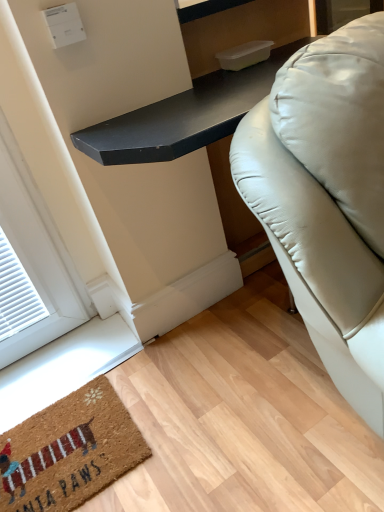
Question: From the image's perspective, is black matte table at center over brown coir mat at lower left?

Choices:
 (A) yes
 (B) no

Answer: (A)

Question: Considering the relative positions of black matte table at center and brown coir mat at lower left in the image provided, is black matte table at center behind brown coir mat at lower left?

Choices:
 (A) yes
 (B) no

Answer: (B)

Question: Is black matte table at center positioned in front of brown coir mat at lower left?

Choices:
 (A) yes
 (B) no

Answer: (A)

Question: Would you say black matte table at center contains brown coir mat at lower left?

Choices:
 (A) yes
 (B) no

Answer: (B)

Question: Is black matte table at center at the right side of brown coir mat at lower left?

Choices:
 (A) no
 (B) yes

Answer: (B)

Question: From a real-world perspective, is black matte table at center physically above brown coir mat at lower left?

Choices:
 (A) yes
 (B) no

Answer: (A)

Question: Can you confirm if brown coir mat at lower left is taller than black matte table at center?

Choices:
 (A) yes
 (B) no

Answer: (B)

Question: Is brown coir mat at lower left oriented towards black matte table at center?

Choices:
 (A) no
 (B) yes

Answer: (A)

Question: Does brown coir mat at lower left have a smaller size compared to black matte table at center?

Choices:
 (A) no
 (B) yes

Answer: (B)

Question: From a real-world perspective, is brown coir mat at lower left beneath black matte table at center?

Choices:
 (A) yes
 (B) no

Answer: (A)

Question: Is brown coir mat at lower left bigger than black matte table at center?

Choices:
 (A) yes
 (B) no

Answer: (B)

Question: Considering the relative sizes of brown coir mat at lower left and black matte table at center in the image provided, is brown coir mat at lower left thinner than black matte table at center?

Choices:
 (A) yes
 (B) no

Answer: (A)

Question: Is black matte table at center inside or outside of brown coir mat at lower left?

Choices:
 (A) inside
 (B) outside

Answer: (B)